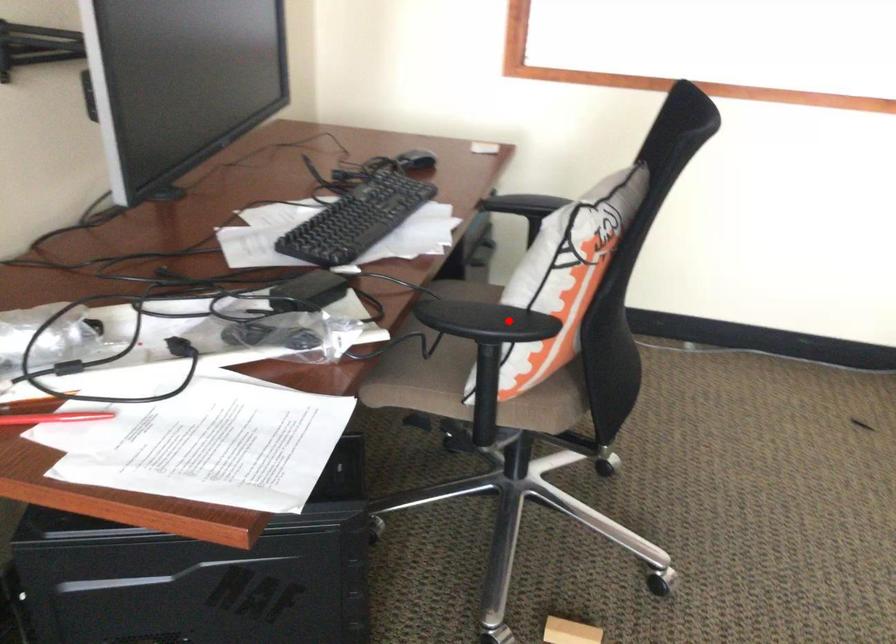
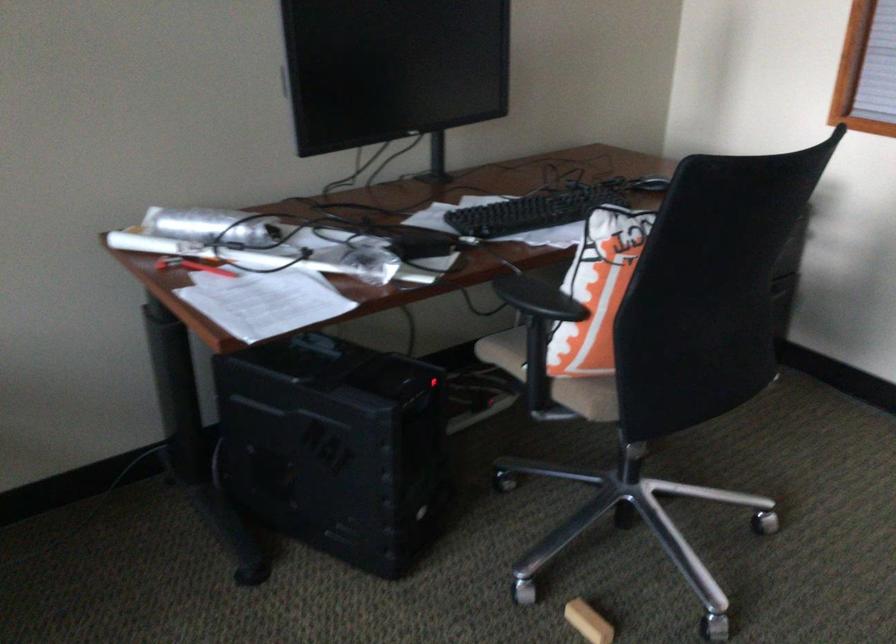
Question: I am providing you with two images of the same scene from different viewpoints. In image1, a red point is highlighted. Considering the same 3D point in image2, which of the following is correct?

Choices:
 (A) It is closer
 (B) It is farther

Answer: (B)